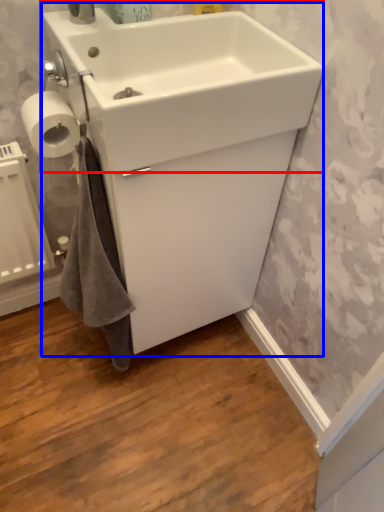
Question: Which point is closer to the camera, sink (highlighted by a red box) or sink (highlighted by a blue box)?

Choices:
 (A) sink
 (B) sink

Answer: (A)